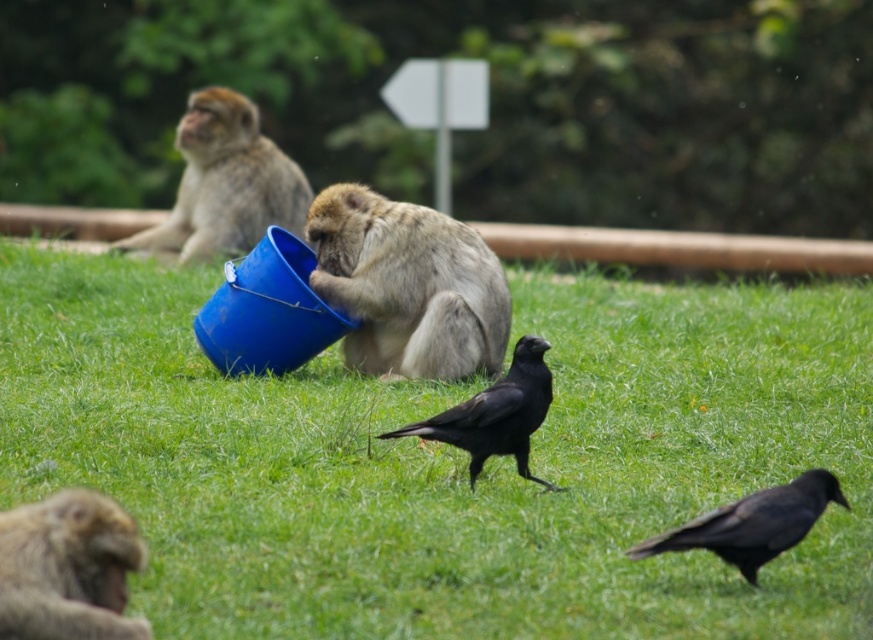
You are a park ranger trying to locate two specific points in the image. The first point is at coordinate point(555, 561) and the second is at point(761, 528). Based on the scene description, which point is closer to the foreground?

Point(761, 528) is closer to the foreground because it has a lower y coordinate value, meaning it is positioned higher up in the image, which typically corresponds to being closer to the viewer in such coordinate systems.

You are a park ranger trying to locate a specific point in the park. The coordinates given are point (448,460). According to the image, where is this point located?

The point (448,460) is on the green grass at center, so it is located on the central green grassy area in the park.

Based on the coordinates provided, which animal is located at point (67, 568) in the scene?

The point (67, 568) marks the location of the brown furry monkey at lower left.